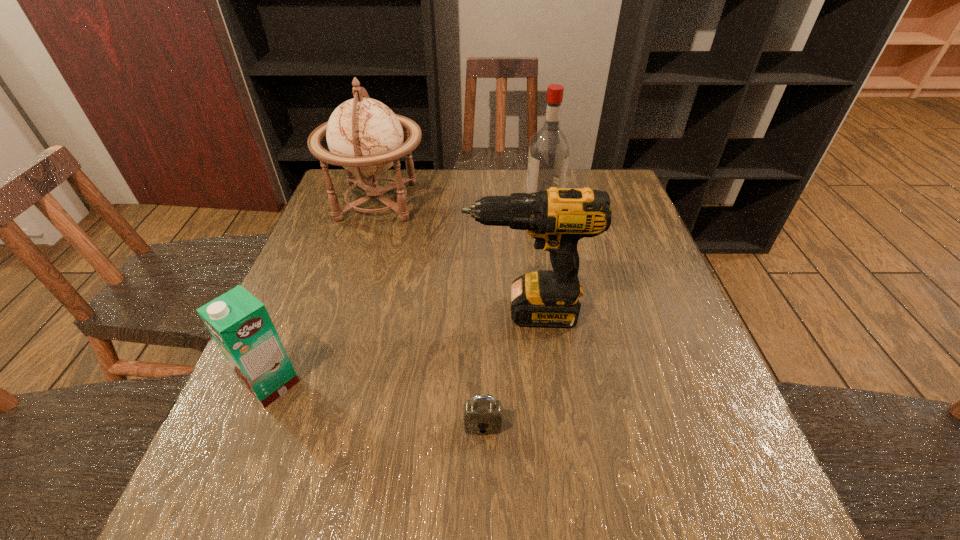
Where is `vacant area that satisfies the following two spatial constraints: 1. at the tip of the drill; 2. at the front of the nearest object near the keyhole`? vacant area that satisfies the following two spatial constraints: 1. at the tip of the drill; 2. at the front of the nearest object near the keyhole is located at coordinates (537, 425).

This screenshot has height=540, width=960. I want to click on free location that satisfies the following two spatial constraints: 1. on the front-facing side of the liquor; 2. at the front of the shortest object near the keyhole, so click(586, 425).